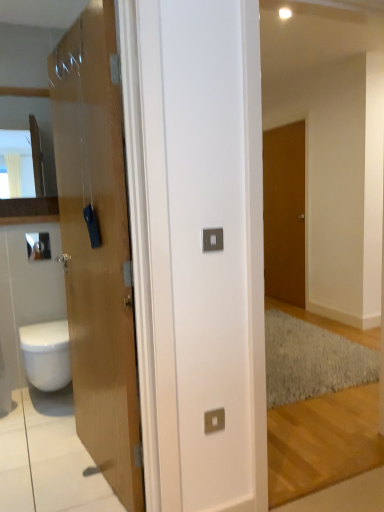
Question: Considering the relative positions of satin silver switch at center, which is counted as the 1th electric outlet, starting from the top, and metallic square at center, arranged as the first electric outlet when ordered from the bottom, in the image provided, is satin silver switch at center, which is counted as the 1th electric outlet, starting from the top, to the left or to the right of metallic square at center, arranged as the first electric outlet when ordered from the bottom,?

Choices:
 (A) right
 (B) left

Answer: (B)

Question: Considering their positions, is satin silver switch at center, the 2th electric outlet in the bottom-to-top sequence, located in front of or behind metallic square at center, the second electric outlet from the front?

Choices:
 (A) behind
 (B) front

Answer: (B)

Question: Which of these objects is positioned closest to the brown matte door at center-right, which is the 1th door in right-to-left order?

Choices:
 (A) matte wood cabinet at left
 (B) satin silver switch at center, which is counted as the 1th electric outlet, starting from the top
 (C) metallic square at center, the second electric outlet from the front
 (D) matte wooden door at left, which is the second door in right-to-left order
 (E) white glossy bidet at lower left

Answer: (A)

Question: Estimate the real-world distances between objects in this image. Which object is closer to the white glossy bidet at lower left?

Choices:
 (A) matte wood cabinet at left
 (B) matte wooden door at left, which is the second door in right-to-left order
 (C) brown matte door at center-right, which is the 1th door in right-to-left order
 (D) metallic square at center, the 2th electric outlet in the top-to-bottom sequence
 (E) satin silver switch at center, which is the second electric outlet from back to front

Answer: (B)